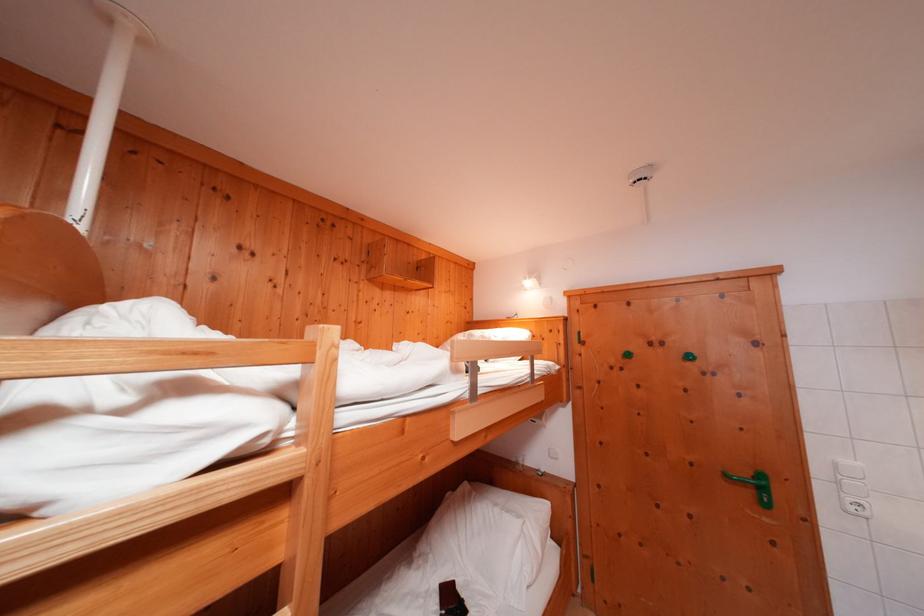
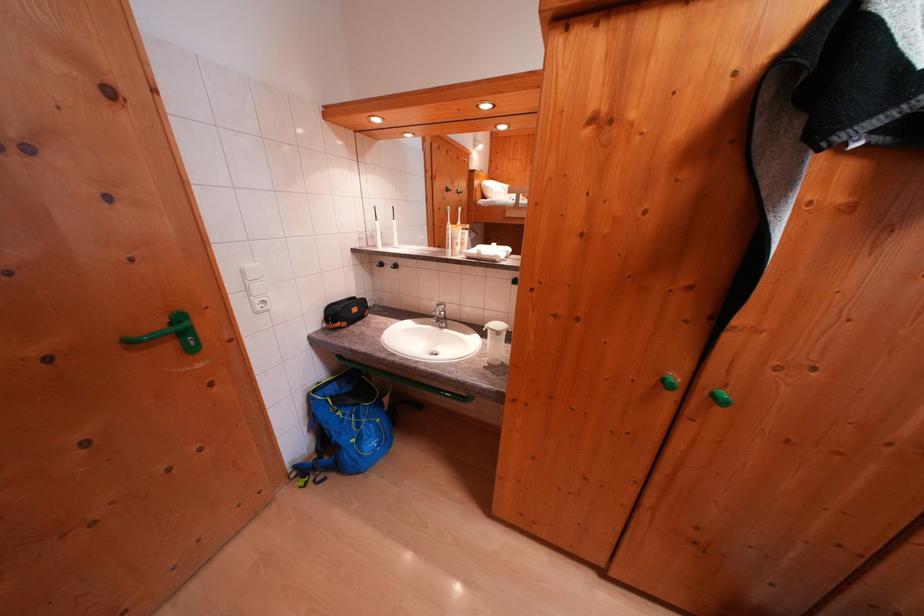
First-person continuous shooting, in which direction is the camera rotating?

The camera's rotation is toward right-down.